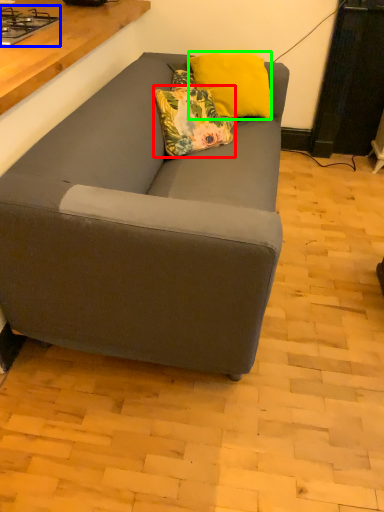
Question: Based on their relative distances, which object is farther from pillow (highlighted by a red box)? Choose from gas stove (highlighted by a blue box) and pillow (highlighted by a green box).

Choices:
 (A) gas stove
 (B) pillow

Answer: (A)